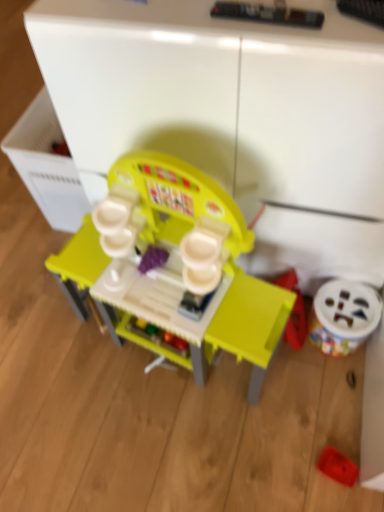
You are a GUI agent. You are given a task and a screenshot of the screen. Output one action in this format:
    pyautogui.click(x=<x>, y=<y>)
    Task: Click on the free location to the left of matte plastic play kitchen at center, the first toy when ordered from left to right
    The height and width of the screenshot is (512, 384).
    Given the screenshot: What is the action you would take?
    pyautogui.click(x=53, y=357)